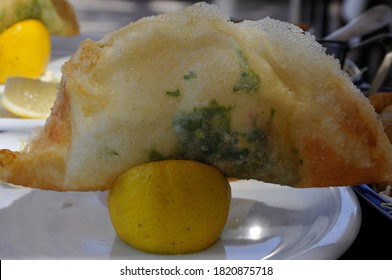
Where is `wood spoon`? The width and height of the screenshot is (392, 280). wood spoon is located at coordinates (363, 22), (376, 80).